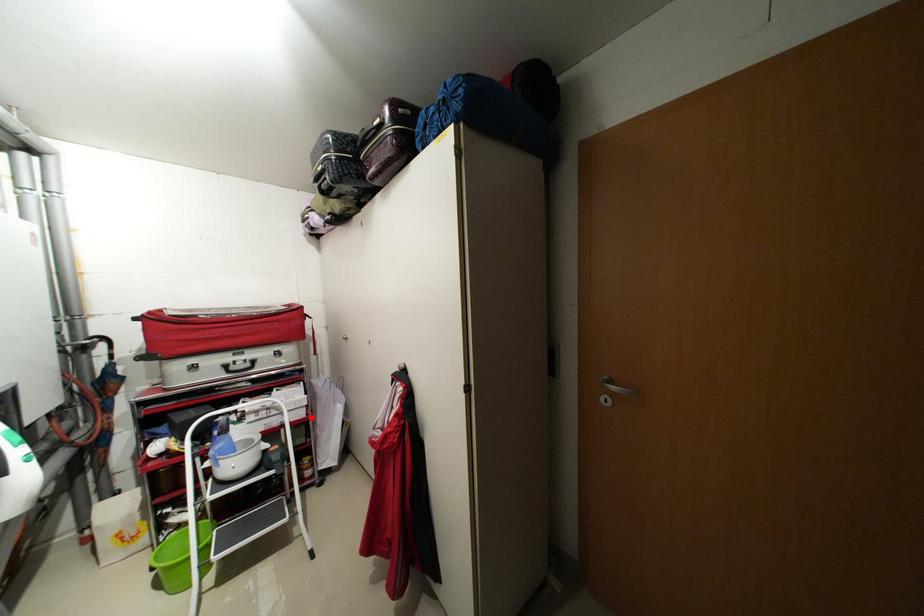
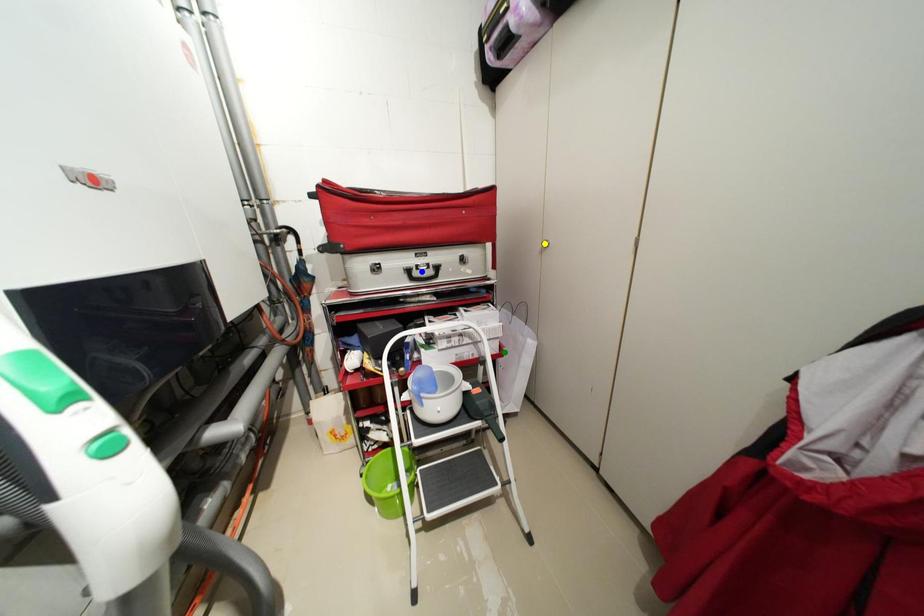
Question: I am providing you with two images of the same scene from different viewpoints. A red point is marked on the first image. You are given multiple points on the second image. Which point in image 2 is actually the same real-world point as the red point in image 1?

Choices:
 (A) blue point
 (B) yellow point
 (C) green point

Answer: (C)